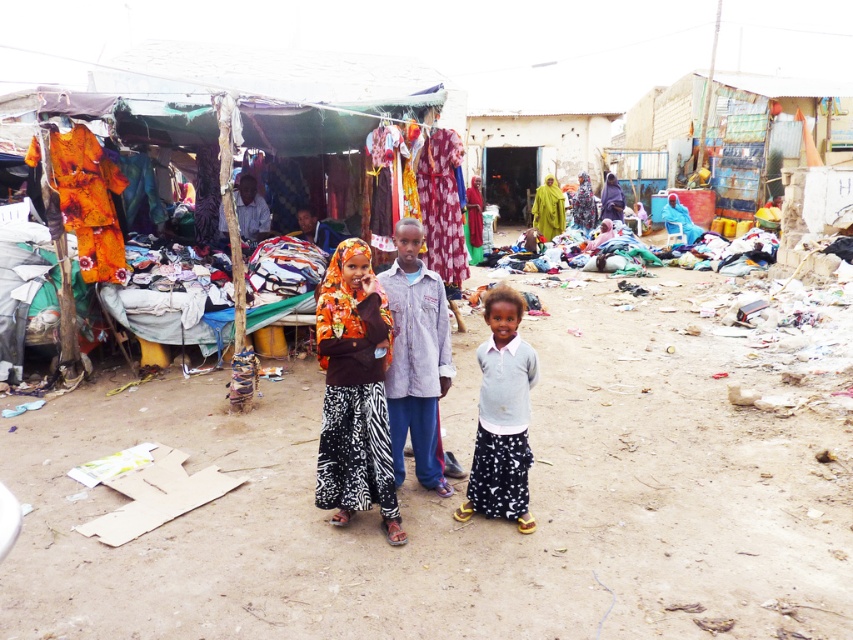
Question: Which point appears closest to the camera in this image?

Choices:
 (A) (492, 474)
 (B) (589, 211)

Answer: (A)

Question: Estimate the real-world distances between objects in this image. Which object is farther from the floral fabric dress at center?

Choices:
 (A) yellow-green fabric at center
 (B) light gray cotton shirt at center

Answer: (B)

Question: Is white dotted skirt at lower right to the left of yellow-green fabric at center from the viewer's perspective?

Choices:
 (A) no
 (B) yes

Answer: (B)

Question: Is the position of yellow-green fabric at center more distant than that of floral fabric dress at center?

Choices:
 (A) yes
 (B) no

Answer: (B)

Question: Does light gray cotton shirt at center appear under yellow-green fabric at center?

Choices:
 (A) no
 (B) yes

Answer: (B)

Question: Based on their relative distances, which object is farther from the yellow-green fabric at center?

Choices:
 (A) printed fabric dress at center
 (B) light gray cotton shirt at center
 (C) floral fabric dress at center

Answer: (A)